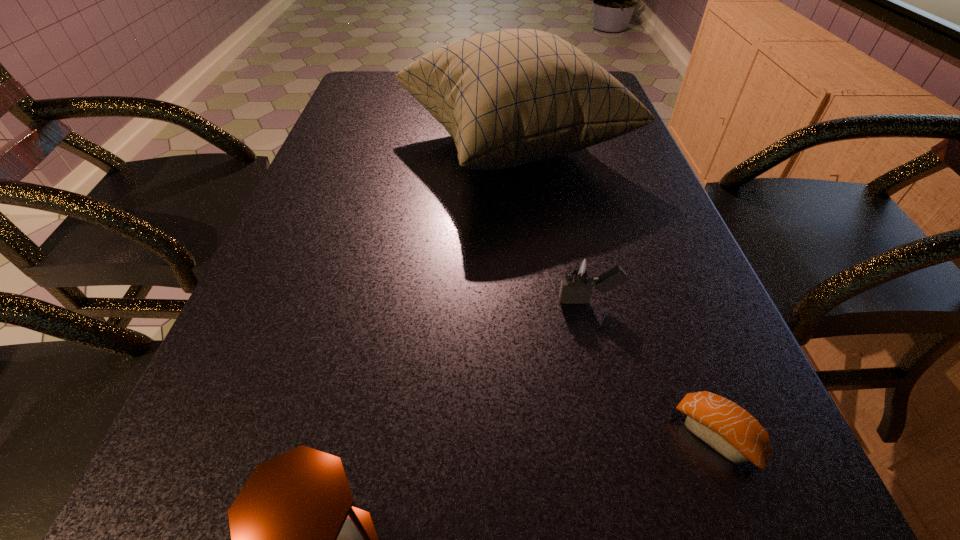
Identify the location of the tallest object. The height and width of the screenshot is (540, 960). (509, 97).

Find the location of a particular element. The height and width of the screenshot is (540, 960). the farthest object is located at coordinates (509, 97).

I want to click on the second shortest object, so click(579, 278).

You are a GUI agent. You are given a task and a screenshot of the screen. Output one action in this format:
    pyautogui.click(x=<x>, y=<y>)
    Task: Click on the second farthest object
    The width and height of the screenshot is (960, 540).
    Given the screenshot: What is the action you would take?
    pyautogui.click(x=579, y=278)

Find the location of a particular element. Image resolution: width=960 pixels, height=540 pixels. sushi is located at coordinates (726, 427).

Identify the location of the third farthest object. (726, 427).

Where is `vacant region located on the left of the farthest object`? vacant region located on the left of the farthest object is located at coordinates (327, 146).

What are the coordinates of `vacant area situated 0.320m on the front of the third nearest object` in the screenshot? It's located at (642, 534).

In order to click on free space located on the back of the sushi in this screenshot , I will do `click(661, 294)`.

I want to click on object that is at the far edge, so click(509, 97).